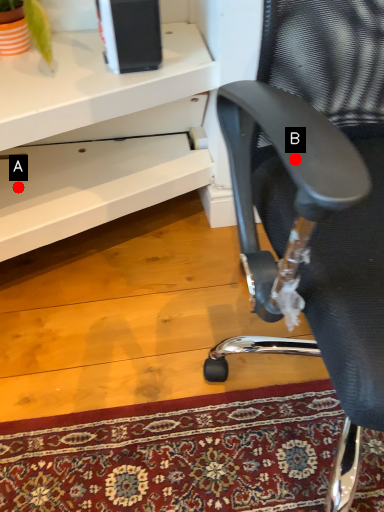
Question: Two points are circled on the image, labeled by A and B beside each circle. Among these points, which one is farthest from the camera?

Choices:
 (A) A is further
 (B) B is further

Answer: (A)